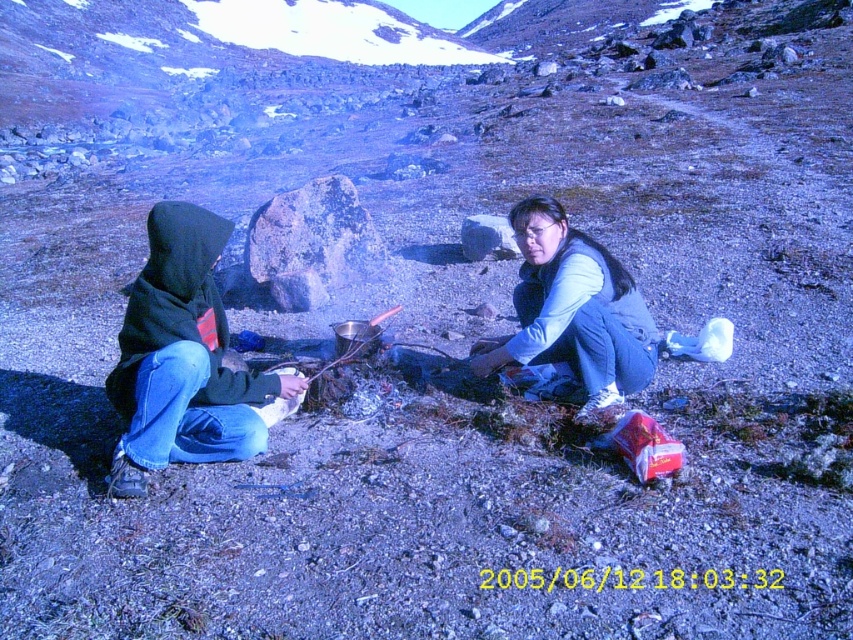
Is point (144, 436) in front of point (296, 388)?

Yes, it is in front of point (296, 388).

Does black hooded jacket at left have a greater width compared to black fleece jacket at left?

Incorrect, black hooded jacket at left's width does not surpass black fleece jacket at left's.

Who is more distant from viewer, [209,276] or [106,394]?

Positioned behind is point [106,394].

Where is `black hooded jacket at left`? black hooded jacket at left is located at coordinates (181, 356).

Is point (201, 394) positioned behind point (544, 221)?

No, (201, 394) is in front of (544, 221).

Does black fleece jacket at left have a larger size compared to blue denim jeans at lower right?

No, black fleece jacket at left is not bigger than blue denim jeans at lower right.

Who is more forward, (x=190, y=221) or (x=537, y=317)?

Point (x=190, y=221) is more forward.

At what (x,y) coordinates should I click in order to perform the action: click on black fleece jacket at left. Please return your answer as a coordinate pair (x, y). Looking at the image, I should click on (183, 358).

Can you confirm if black hooded jacket at left is shorter than blue denim jeans at lower right?

No, black hooded jacket at left is not shorter than blue denim jeans at lower right.

Does black hooded jacket at left appear under blue denim jeans at lower right?

Correct, black hooded jacket at left is located below blue denim jeans at lower right.

Image resolution: width=853 pixels, height=640 pixels. What do you see at coordinates (181, 356) in the screenshot?
I see `black hooded jacket at left` at bounding box center [181, 356].

This screenshot has width=853, height=640. I want to click on black hooded jacket at left, so click(181, 356).